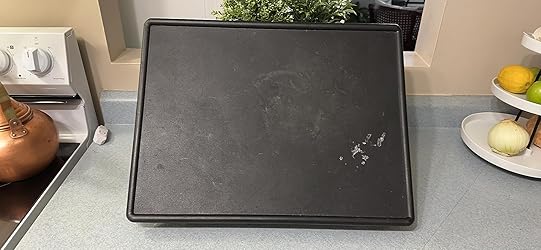
You are a GUI agent. You are given a task and a screenshot of the screen. Output one action in this format:
    pyautogui.click(x=<x>, y=<y>)
    Task: Click on the countertop
    
    Given the screenshot: What is the action you would take?
    [x=100, y=206]